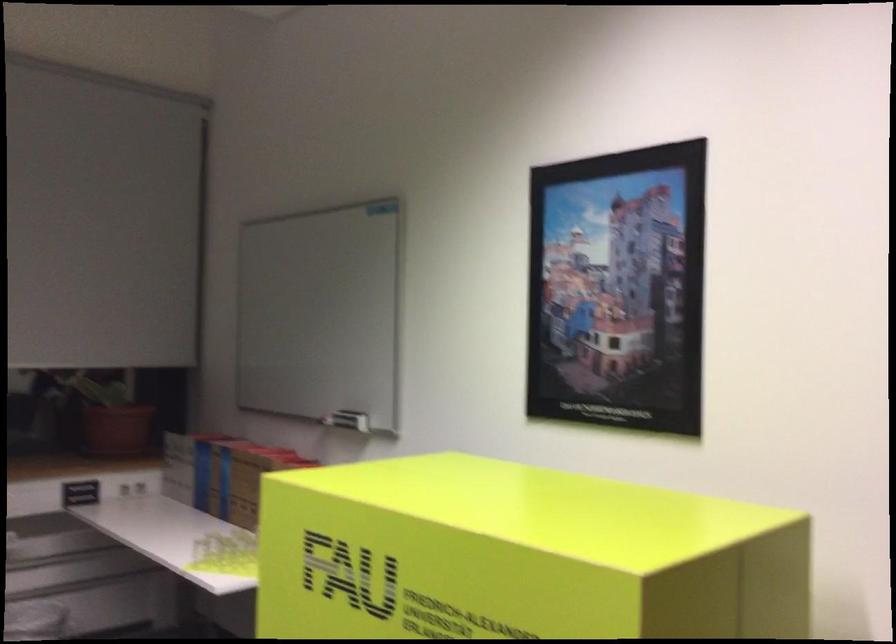
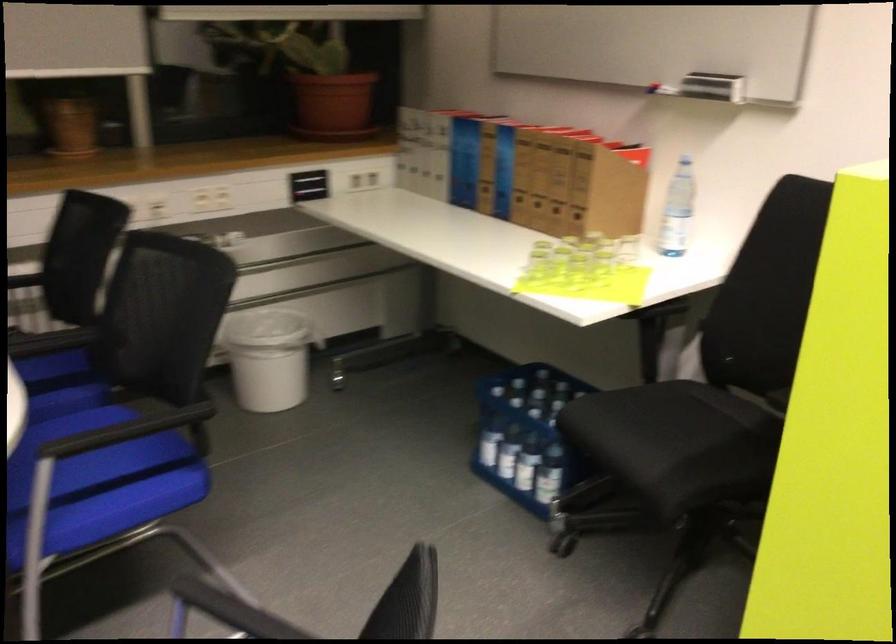
In the scene shown: Which direction would the cameraman need to move to produce the second image?

The cameraman walked toward left, forward.